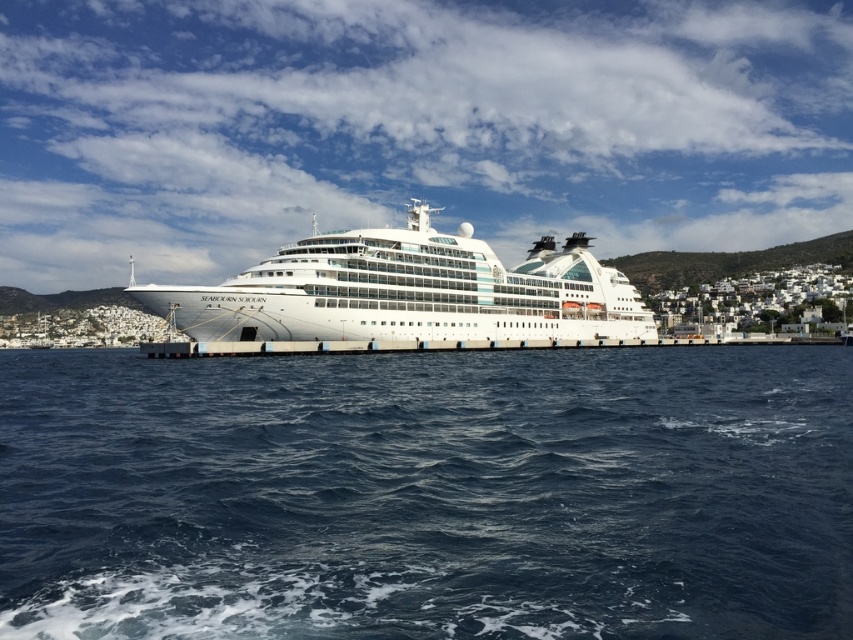
You are standing on the pier and looking out towards the dark blue water at center and the white glossy cruise ship at center. Which object is closer to you?

The dark blue water at center is closer to you because it is in front of the white glossy cruise ship at center.

From the picture: You are standing on the pier looking at the cruise ship Seabourn Sojourn. There are two points marked on the ship. The first point is at coordinate point (86, 563) and the second is at point (410, 232). Which point is closer to you?

Point (86, 563) is closer to the viewer than point (410, 232).

You are standing on the pier and see the dark blue water at center and the white glossy cruise ship at center. Which one is located to the right of the other?

The dark blue water at center is positioned on the right side of white glossy cruise ship at center.